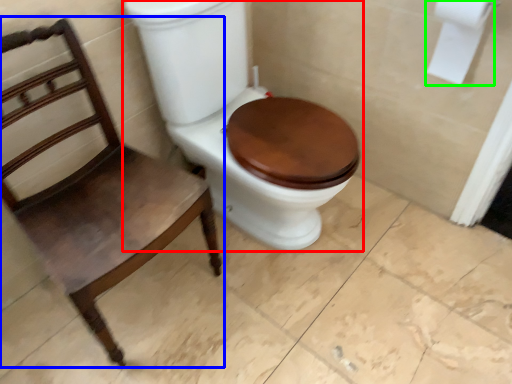
Question: Estimate the real-world distances between objects in this image. Which object is closer to toilet (highlighted by a red box), chair (highlighted by a blue box) or toilet paper (highlighted by a green box)?

Choices:
 (A) chair
 (B) toilet paper

Answer: (A)